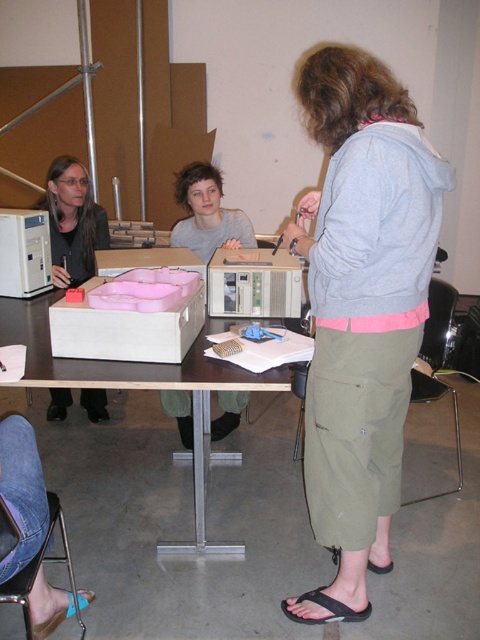
Can you confirm if matte gray shirt at center is positioned to the left of black rubber sandal at lower center?

Yes, matte gray shirt at center is to the left of black rubber sandal at lower center.

Is matte gray shirt at center positioned behind black rubber sandal at lower center?

Yes.

Is point (222, 188) more distant than point (370, 609)?

Yes.

At what (x,y) coordinates should I click in order to perform the action: click on matte gray shirt at center. Please return your answer as a coordinate pair (x, y). The height and width of the screenshot is (640, 480). Looking at the image, I should click on (207, 212).

Does point (43, 202) come closer to viewer compared to point (215, 285)?

That is False.

Is matte black laptop at left smaller than matte plastic box at center?

Incorrect, matte black laptop at left is not smaller in size than matte plastic box at center.

Locate an element on the screen. This screenshot has width=480, height=640. matte black laptop at left is located at coordinates (72, 221).

Does wooden table at center have a greater width compared to black fabric sandal at lower center?

Yes, wooden table at center is wider than black fabric sandal at lower center.

Does wooden table at center come behind black fabric sandal at lower center?

No.

Is point (242, 380) in front of point (391, 564)?

Yes, it is.

This screenshot has height=640, width=480. I want to click on wooden table at center, so click(x=137, y=388).